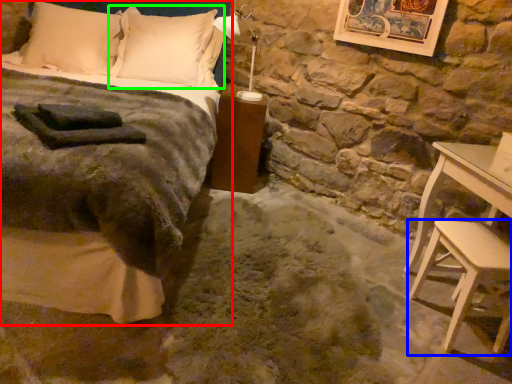
Question: Based on their relative distances, which object is nearer to bed (highlighted by a red box)? Choose from stool (highlighted by a blue box) and pillow (highlighted by a green box).

Choices:
 (A) stool
 (B) pillow

Answer: (B)